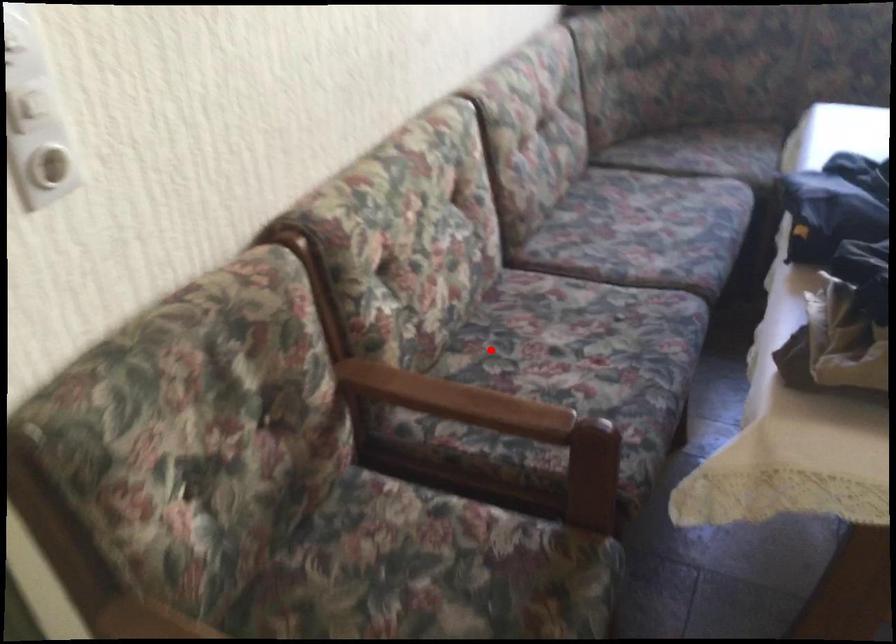
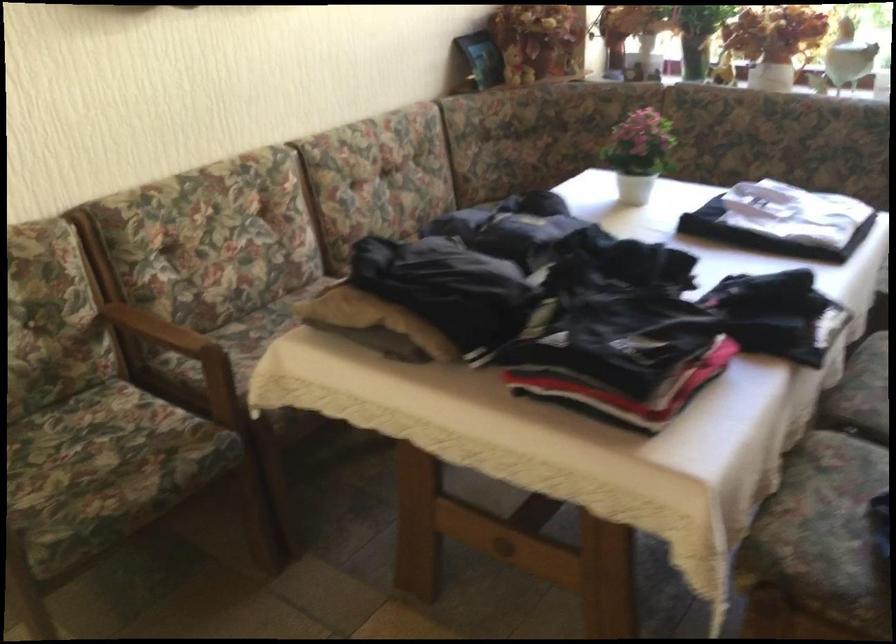
Question: A red point is marked in image1. In image2, is the corresponding 3D point closer to the camera or farther? Reply with the corresponding letter.

Choices:
 (A) The corresponding 3D point is closer.
 (B) The corresponding 3D point is farther.

Answer: (B)